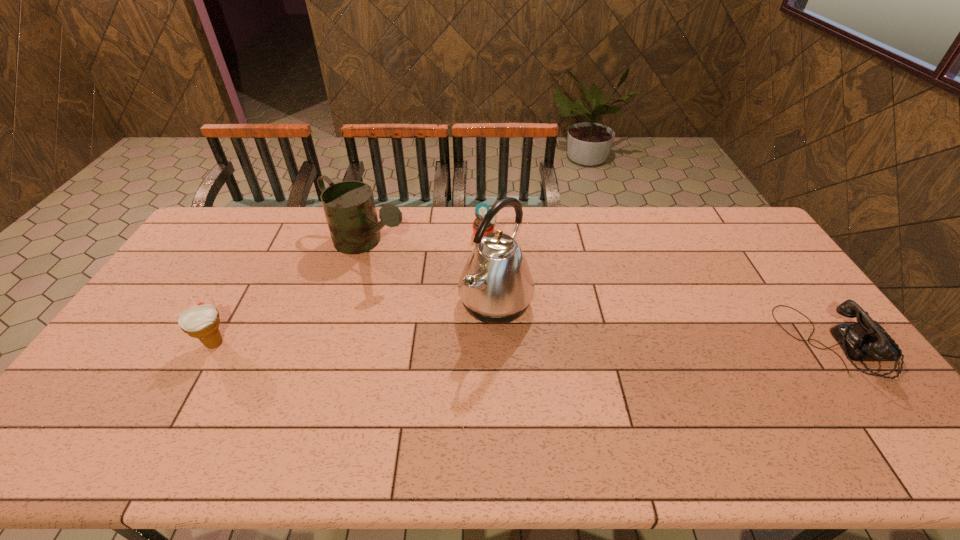
Locate an element on the screen. The height and width of the screenshot is (540, 960). the leftmost object is located at coordinates (201, 321).

Locate an element on the screen. icecream is located at coordinates (201, 321).

The image size is (960, 540). I want to click on the rightmost object, so click(867, 340).

Find the location of a particular element. The image size is (960, 540). kettle is located at coordinates (496, 286).

Identify the location of muffin. This screenshot has height=540, width=960. (481, 209).

Locate an element on the screen. This screenshot has width=960, height=540. watering can is located at coordinates (349, 206).

You are a GUI agent. You are given a task and a screenshot of the screen. Output one action in this format:
    pyautogui.click(x=<x>, y=<y>)
    Task: Click on the second object from left to right
    Image resolution: width=960 pixels, height=540 pixels.
    Given the screenshot: What is the action you would take?
    pyautogui.click(x=349, y=206)

The width and height of the screenshot is (960, 540). Identify the location of vacant space located on the left of the leftmost object. (134, 343).

You are a GUI agent. You are given a task and a screenshot of the screen. Output one action in this format:
    pyautogui.click(x=<x>, y=<y>)
    Task: Click on the free space located from the spout of the kettle
    The height and width of the screenshot is (540, 960).
    Given the screenshot: What is the action you would take?
    pyautogui.click(x=635, y=375)

Locate an element on the screen. This screenshot has width=960, height=540. vacant space located 0.380m from the spout of the kettle is located at coordinates (654, 384).